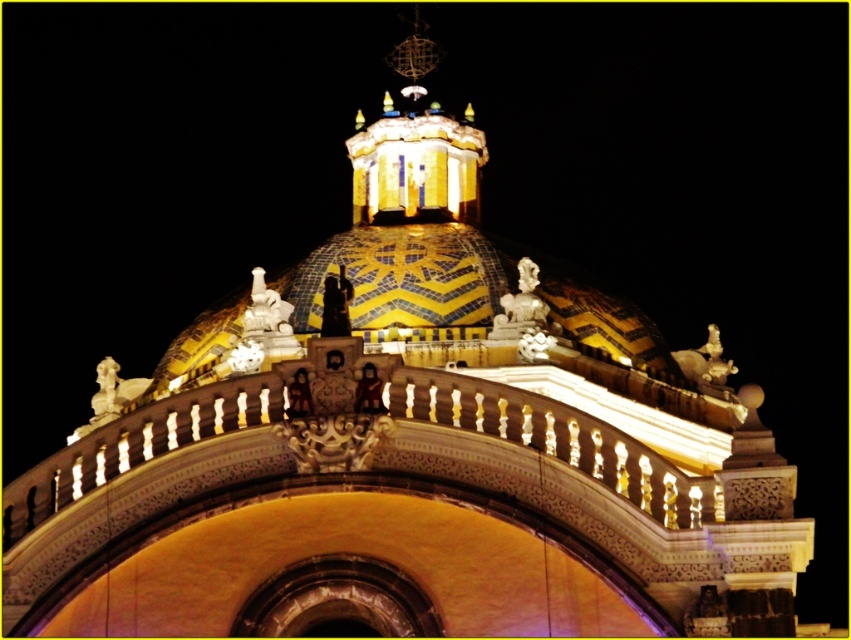
Who is more distant from viewer, (700, 381) or (347, 301)?

The point (700, 381) is behind.

Does point (695, 355) lie in front of point (347, 288)?

No, (695, 355) is behind (347, 288).

The width and height of the screenshot is (851, 640). In order to click on gold metallic statue at upper right in this screenshot , I will do `click(705, 362)`.

Is white marble statue at upper center wider than polished bronze statue at center?

No, white marble statue at upper center is not wider than polished bronze statue at center.

Which of these two, white marble statue at upper center or polished bronze statue at center, stands taller?

polished bronze statue at center is taller.

This screenshot has width=851, height=640. I want to click on white marble statue at upper center, so click(x=521, y=307).

You are a GUI agent. You are given a task and a screenshot of the screen. Output one action in this format:
    pyautogui.click(x=<x>, y=<y>)
    Task: Click on the white marble statue at upper center
    
    Given the screenshot: What is the action you would take?
    pyautogui.click(x=521, y=307)

Does white marble statue at upper center appear on the left side of gold metallic statue at upper right?

Correct, you'll find white marble statue at upper center to the left of gold metallic statue at upper right.

Does white marble statue at upper center have a smaller size compared to gold metallic statue at upper right?

Correct, white marble statue at upper center occupies less space than gold metallic statue at upper right.

Does point (517, 321) come closer to viewer compared to point (672, 352)?

Yes.

The height and width of the screenshot is (640, 851). Find the location of `white marble statue at upper center`. white marble statue at upper center is located at coordinates (521, 307).